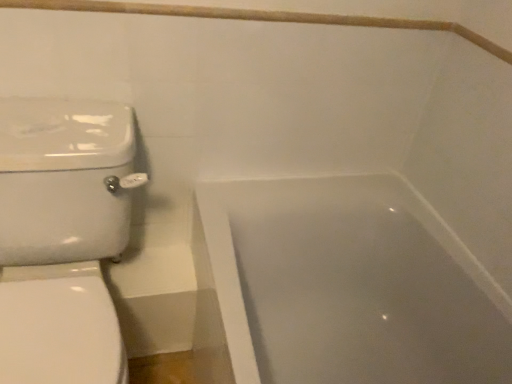
Question: Is white glossy bathtub at lower right completely or partially outside of wooden balustrade at upper center?

Choices:
 (A) yes
 (B) no

Answer: (A)

Question: Is wooden balustrade at upper center inside white glossy bathtub at lower right?

Choices:
 (A) yes
 (B) no

Answer: (B)

Question: Is white glossy bathtub at lower right smaller than wooden balustrade at upper center?

Choices:
 (A) yes
 (B) no

Answer: (B)

Question: Considering the relative sizes of white glossy bathtub at lower right and wooden balustrade at upper center in the image provided, is white glossy bathtub at lower right wider than wooden balustrade at upper center?

Choices:
 (A) no
 (B) yes

Answer: (B)

Question: Considering the relative sizes of white glossy bathtub at lower right and wooden balustrade at upper center in the image provided, is white glossy bathtub at lower right taller than wooden balustrade at upper center?

Choices:
 (A) no
 (B) yes

Answer: (B)

Question: From the image's perspective, relative to wooden balustrade at upper center, is white glossy bathtub at lower right above or below?

Choices:
 (A) above
 (B) below

Answer: (B)

Question: Considering their positions, is white glossy bathtub at lower right located in front of or behind wooden balustrade at upper center?

Choices:
 (A) behind
 (B) front

Answer: (B)

Question: In the image, is white glossy bathtub at lower right on the left side or the right side of wooden balustrade at upper center?

Choices:
 (A) right
 (B) left

Answer: (A)

Question: Based on their sizes in the image, would you say white glossy bathtub at lower right is bigger or smaller than wooden balustrade at upper center?

Choices:
 (A) small
 (B) big

Answer: (B)

Question: From a real-world perspective, relative to white glossy bathtub at lower right, is white glossy toilet at left vertically above or below?

Choices:
 (A) above
 (B) below

Answer: (A)

Question: Looking at their shapes, would you say white glossy toilet at left is wider or thinner than white glossy bathtub at lower right?

Choices:
 (A) wide
 (B) thin

Answer: (A)

Question: Considering their positions, is white glossy toilet at left located in front of or behind white glossy bathtub at lower right?

Choices:
 (A) behind
 (B) front

Answer: (B)

Question: Would you say white glossy toilet at left is inside or outside white glossy bathtub at lower right?

Choices:
 (A) outside
 (B) inside

Answer: (A)

Question: Looking at their shapes, would you say white glossy toilet at left is wider or thinner than wooden balustrade at upper center?

Choices:
 (A) thin
 (B) wide

Answer: (B)

Question: Is white glossy toilet at left in front of or behind wooden balustrade at upper center in the image?

Choices:
 (A) front
 (B) behind

Answer: (A)